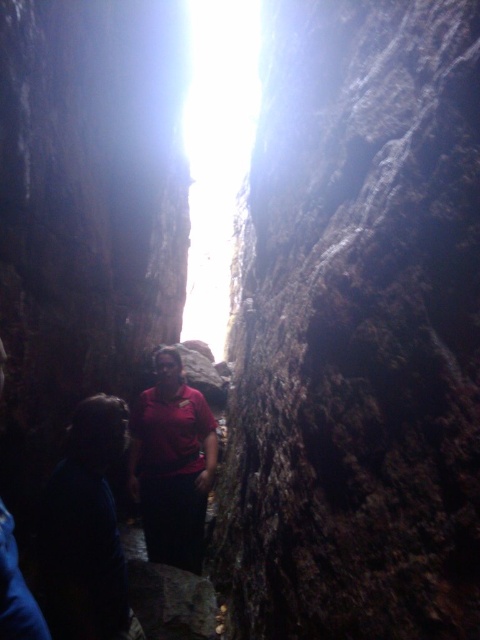
Question: Does dark blue shirt at left appear under matte red shirt at center?

Choices:
 (A) yes
 (B) no

Answer: (B)

Question: Which of the following is the farthest from the observer?

Choices:
 (A) (93, 620)
 (B) (179, 360)

Answer: (B)

Question: From the image, what is the correct spatial relationship of dark blue shirt at left in relation to matte red shirt at center?

Choices:
 (A) left
 (B) right

Answer: (A)

Question: Observing the image, what is the correct spatial positioning of dark blue shirt at left in reference to matte red shirt at center?

Choices:
 (A) right
 (B) left

Answer: (B)

Question: Among these objects, which one is nearest to the camera?

Choices:
 (A) matte red shirt at center
 (B) dark blue shirt at left

Answer: (B)